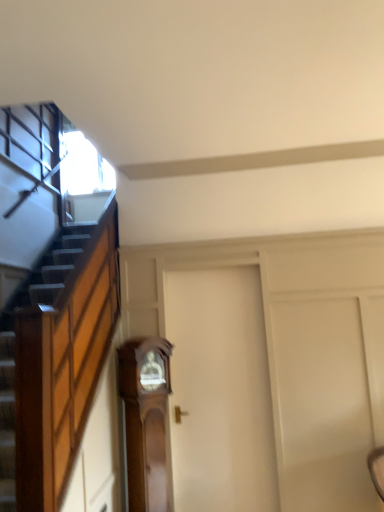
Find the location of a particular element. blank space above white matte door at center (from a real-world perspective) is located at coordinates (210, 269).